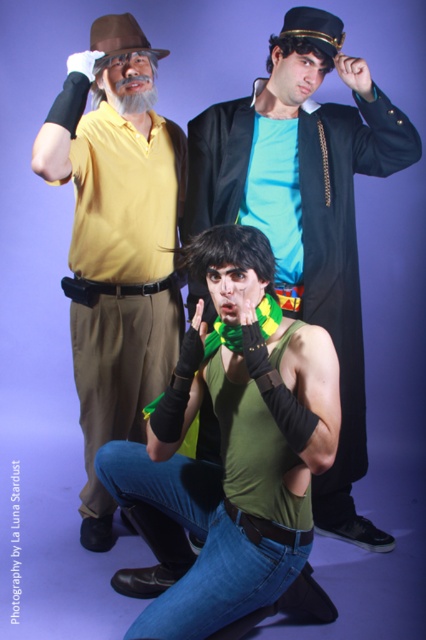
Question: Among these points, which one is farthest from the camera?

Choices:
 (A) (311, 518)
 (B) (126, 429)

Answer: (B)

Question: Which of the following is the closest to the observer?

Choices:
 (A) (94, 276)
 (B) (141, 518)
 (C) (299, 60)

Answer: (B)

Question: Does green matte vest at center appear on the left side of green matte tank top at center?

Choices:
 (A) no
 (B) yes

Answer: (B)

Question: Is green matte tank top at center wider than matte yellow shirt at upper left?

Choices:
 (A) yes
 (B) no

Answer: (A)

Question: Can you confirm if green matte vest at center is positioned above green matte tank top at center?

Choices:
 (A) no
 (B) yes

Answer: (A)

Question: Which object appears closest to the camera in this image?

Choices:
 (A) matte yellow shirt at upper left
 (B) green matte vest at center

Answer: (B)